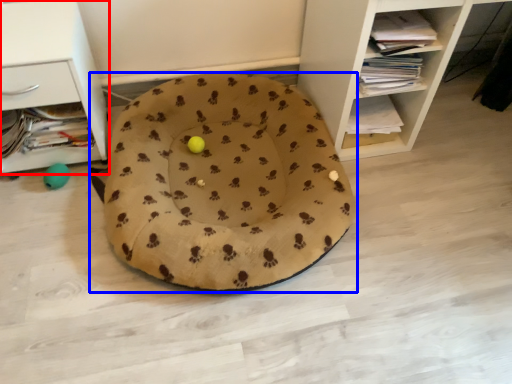
Question: Which of the following is the farthest to the observer, shelf (highlighted by a red box) or dog bed (highlighted by a blue box)?

Choices:
 (A) shelf
 (B) dog bed

Answer: (A)